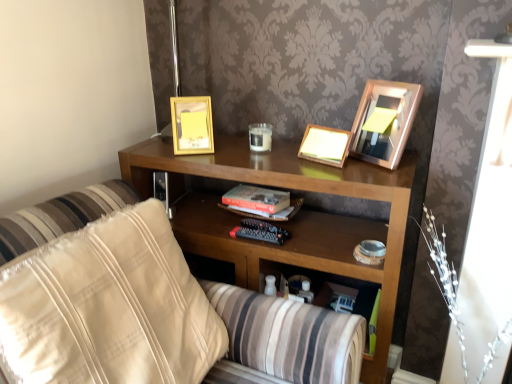
Question: From a real-world perspective, relative to beige fabric pillow at left, is wooden shelf at center vertically above or below?

Choices:
 (A) below
 (B) above

Answer: (A)

Question: Is point (380, 278) positioned closer to the camera than point (27, 354)?

Choices:
 (A) farther
 (B) closer

Answer: (A)

Question: Estimate the real-world distances between objects in this image. Which object is farther from the gold metallic picture frame at upper center, which ranks as the 1th picture frame in left-to-right order?

Choices:
 (A) wooden shelf at center
 (B) wooden picture frame at center, which is counted as the 2th picture frame, starting from the left
 (C) gold metallic picture frame at upper right, the 1th picture frame from the right
 (D) beige fabric pillow at left

Answer: (C)

Question: Which is nearer to the gold metallic picture frame at upper center, acting as the third picture frame starting from the right?

Choices:
 (A) wooden picture frame at center, the second picture frame viewed from the right
 (B) gold metallic picture frame at upper right, arranged as the 3th picture frame when viewed from the left
 (C) wooden shelf at center
 (D) beige fabric pillow at left

Answer: (C)